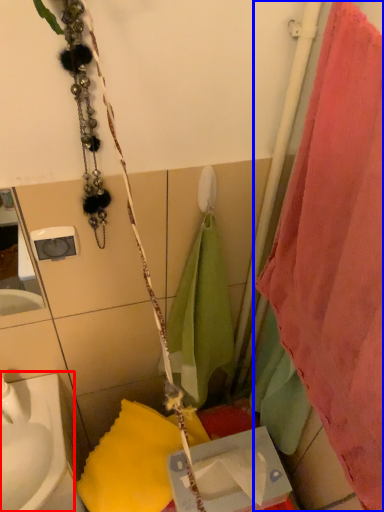
Question: Which object appears farthest to the camera in this image, sink (highlighted by a red box) or curtain (highlighted by a blue box)?

Choices:
 (A) sink
 (B) curtain

Answer: (A)